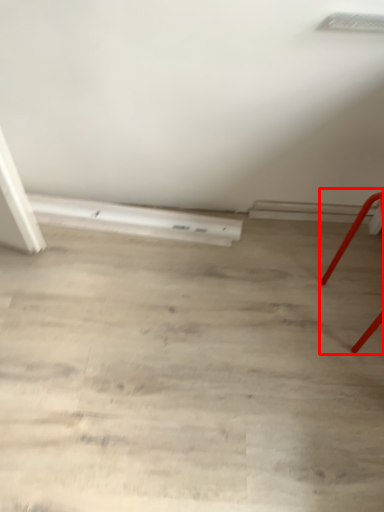
Question: From the image's perspective, what is the correct spatial positioning of furniture (annotated by the red box) in reference to plank?

Choices:
 (A) above
 (B) below

Answer: (B)